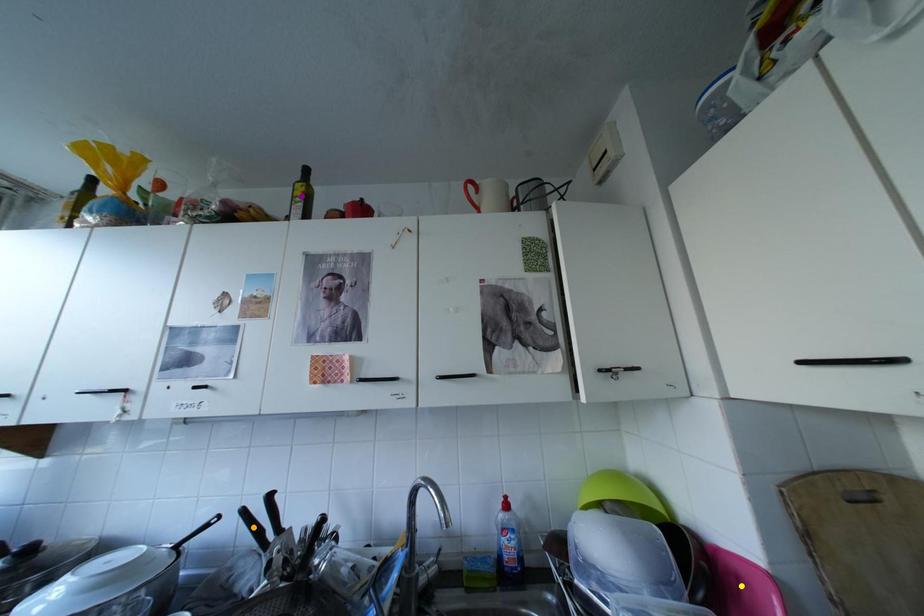
Order these from nearest to farthest:
orange point, purple point, yellow point

yellow point
orange point
purple point